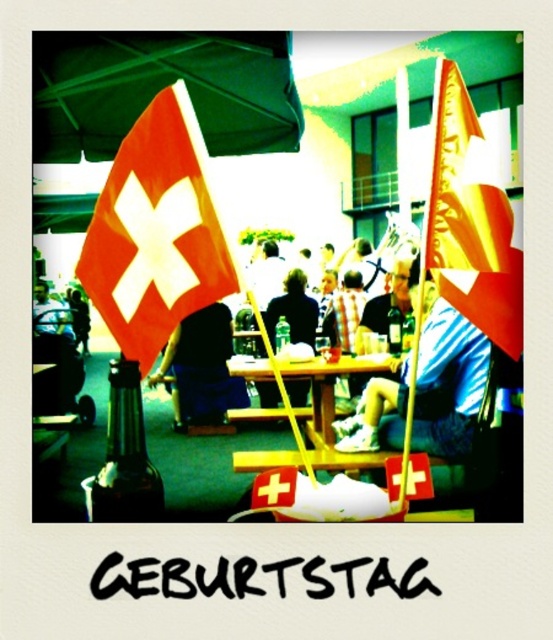
Question: Is dark blue fabric at center thinner than yellow wood picnic table at center?

Choices:
 (A) no
 (B) yes

Answer: (B)

Question: Is orange fabric flag at center to the right of dark blue shirt at center from the viewer's perspective?

Choices:
 (A) yes
 (B) no

Answer: (B)

Question: Based on their relative distances, which object is farther from the blue striped shirt at center?

Choices:
 (A) orange satin flag at upper right
 (B) yellow wood picnic table at center

Answer: (A)

Question: Which of these objects is positioned closest to the dark blue fabric at center?

Choices:
 (A) yellow wood picnic table at center
 (B) blue striped shirt at center
 (C) orange satin flag at upper right

Answer: (A)

Question: Does blue striped shirt at center appear under yellow wood picnic table at center?

Choices:
 (A) no
 (B) yes

Answer: (A)

Question: Estimate the real-world distances between objects in this image. Which object is closer to the blue striped shirt at center?

Choices:
 (A) dark blue fabric at center
 (B) yellow wood picnic table at center
 (C) dark blue shirt at center

Answer: (B)